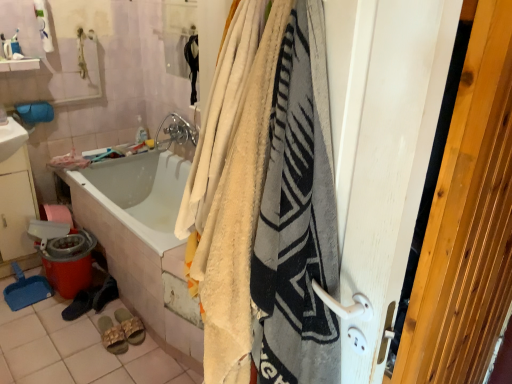
Where is `free location to the left of gold fabric slippers at lower center, positioned as the 3th footwear in left-to-right order`? This screenshot has width=512, height=384. free location to the left of gold fabric slippers at lower center, positioned as the 3th footwear in left-to-right order is located at coordinates (73, 336).